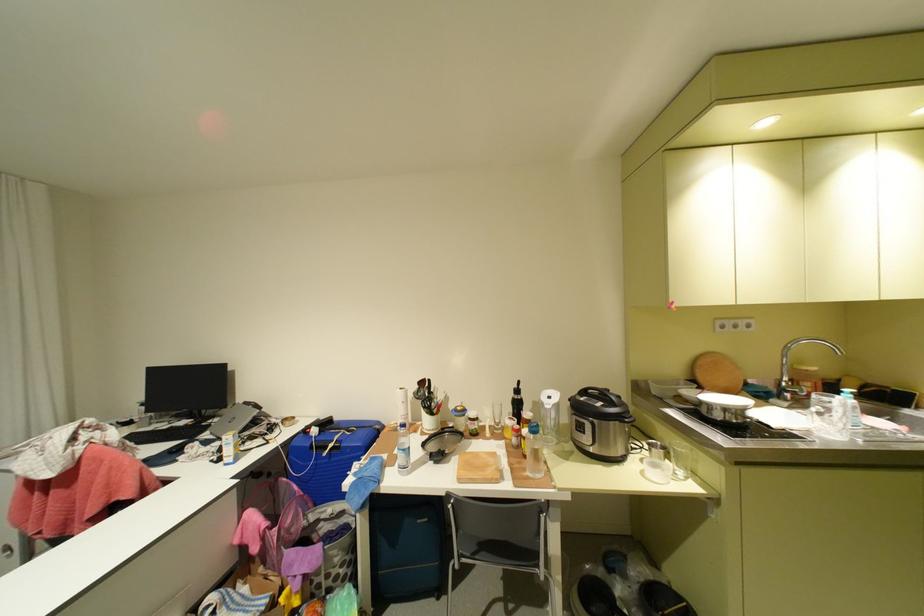
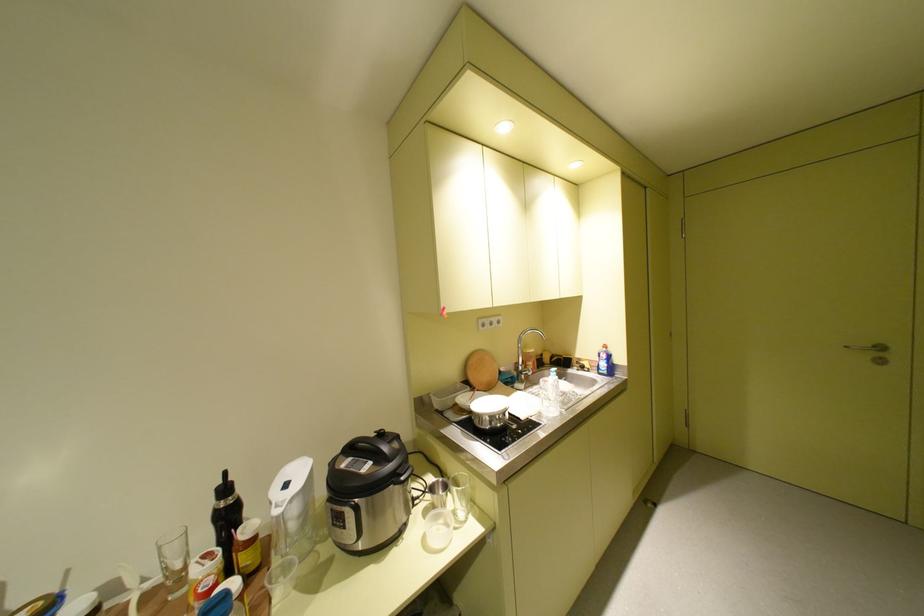
Find the pixel in the second image that matches point 711,379 in the first image.

(482, 379)